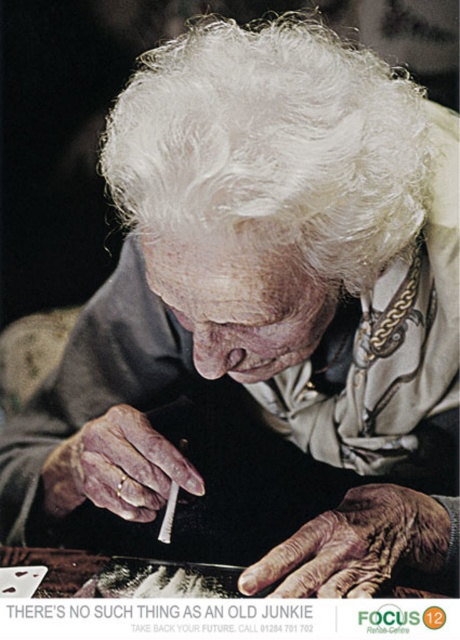
You are an art curator examining this photograph. The image has two cigarettes, a white leather cigarette at lower left and a white matte cigarette at center. Which cigarette is wider?

The white leather cigarette at lower left is wider than the white matte cigarette at center.

What is the 2D coordinate of the white fluffy hair at upper center in the image?

The white fluffy hair at upper center is located at the 2D coordinate point of (x=270, y=148).